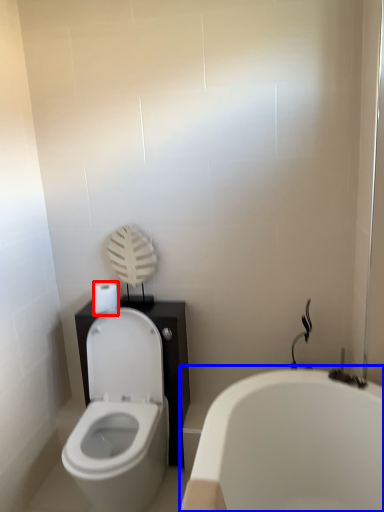
Question: Which of the following is the farthest to the observer, toilet paper (highlighted by a red box) or bathtub (highlighted by a blue box)?

Choices:
 (A) toilet paper
 (B) bathtub

Answer: (A)